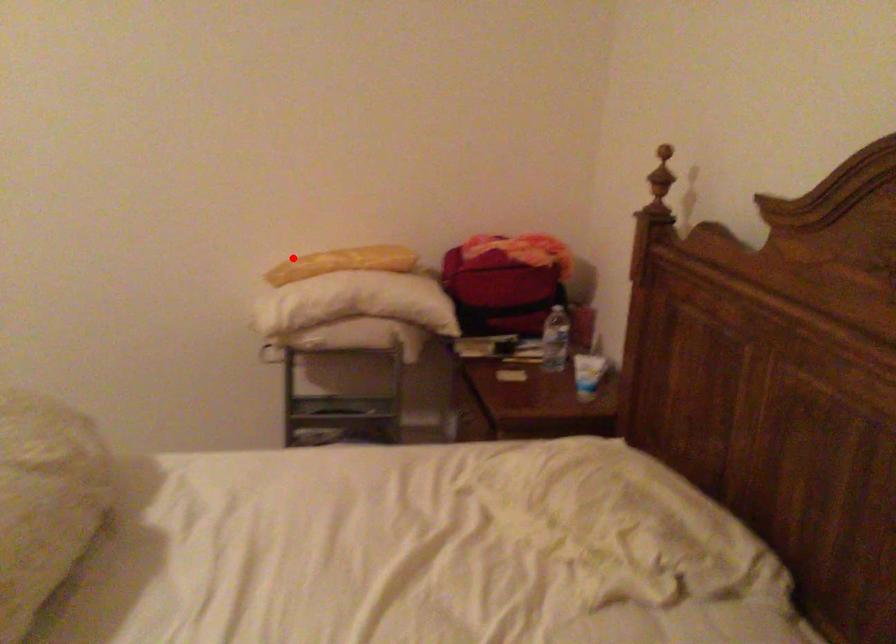
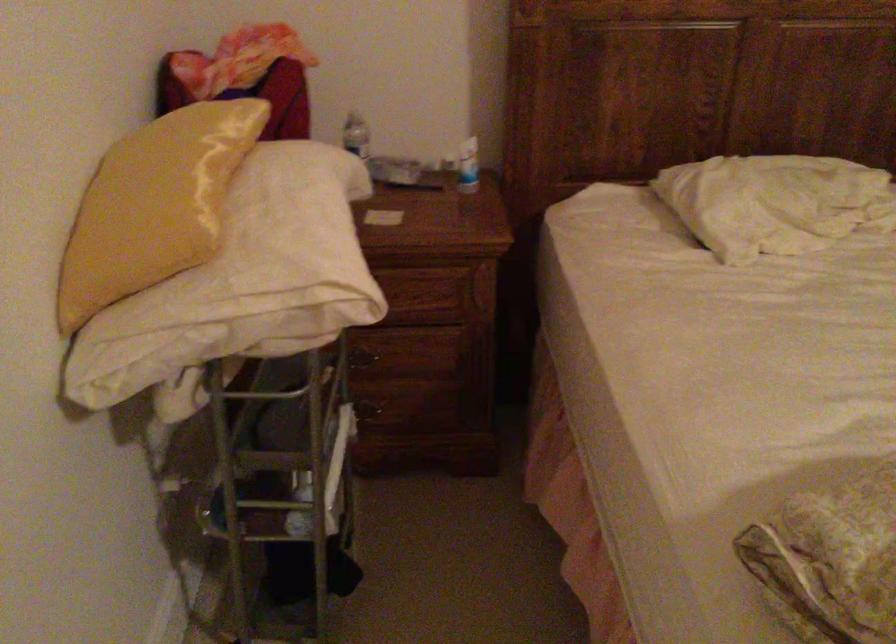
In the second image, find the point that corresponds to the highlighted location in the first image.

(153, 205)